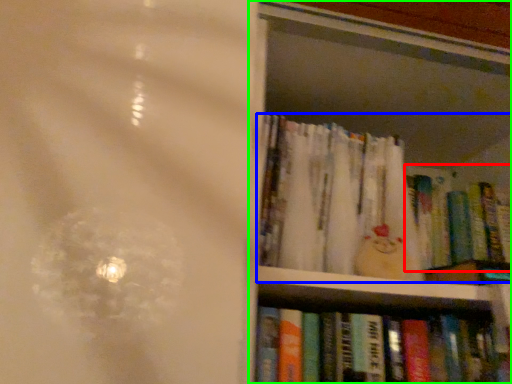
Question: Which object is the farthest from book (highlighted by a red box)? Choose among these: book (highlighted by a blue box) or bookcase (highlighted by a green box).

Choices:
 (A) book
 (B) bookcase

Answer: (B)